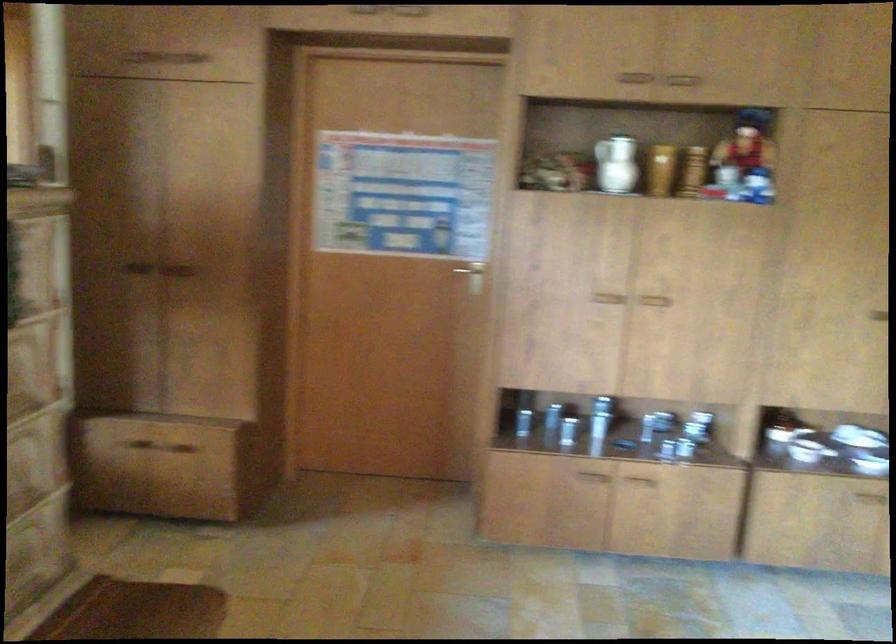
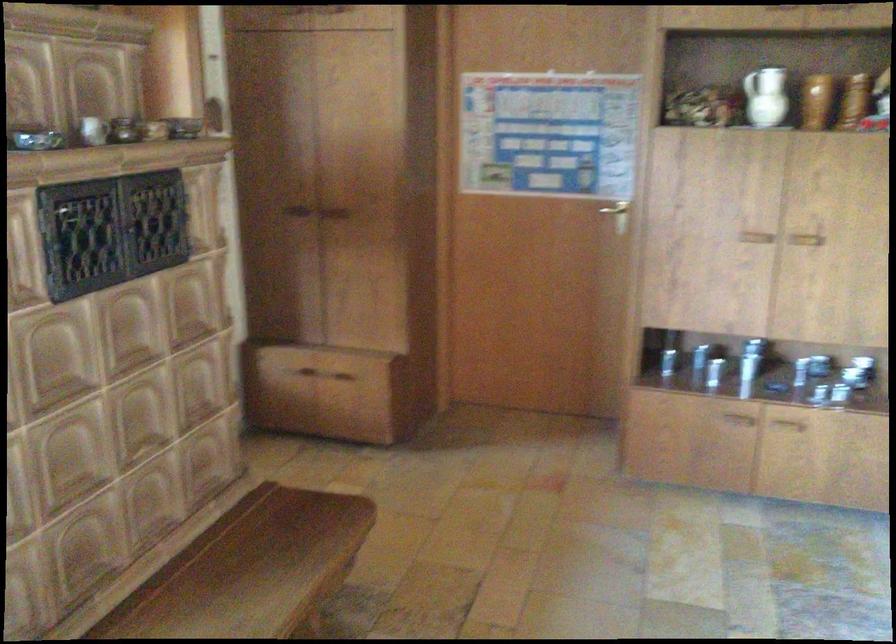
Locate, in the second image, the point that corresponds to [636,301] in the first image.

(785, 238)